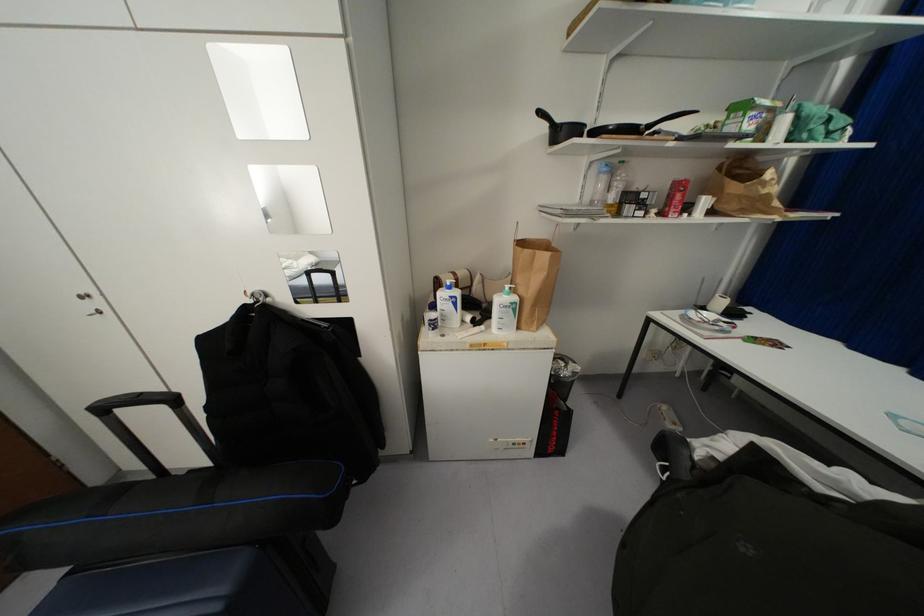
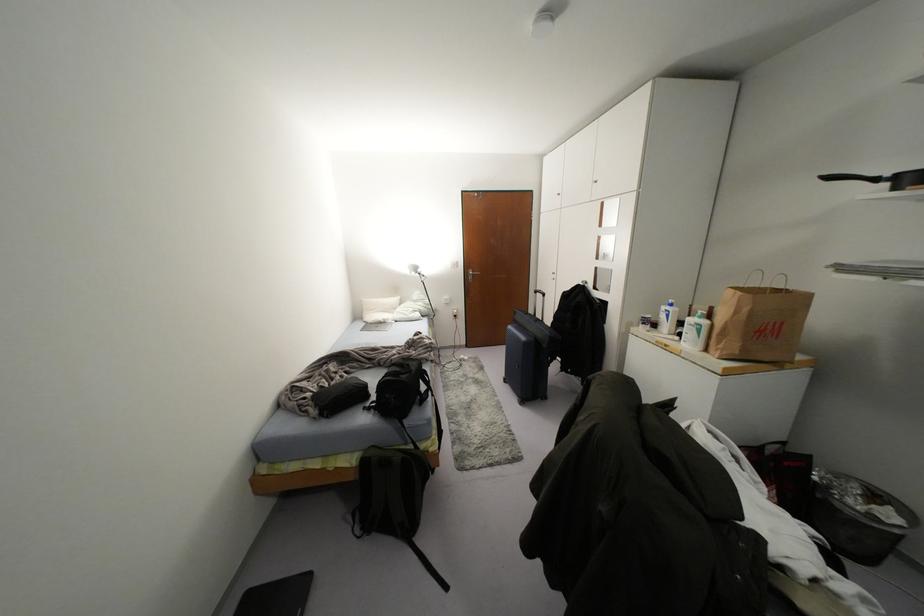
The point at (515, 298) is marked in the first image. Where is the corresponding point in the second image?

(703, 322)